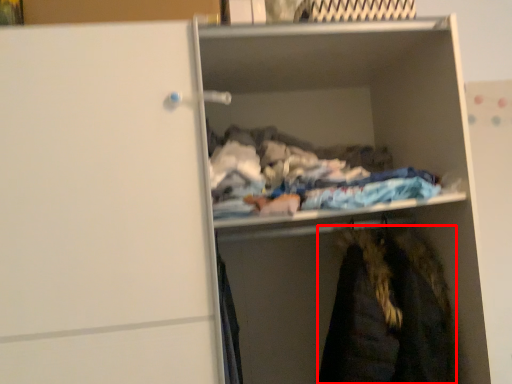
Question: In this image, where is cloak (annotated by the red box) located relative to cabinet?

Choices:
 (A) left
 (B) right

Answer: (B)